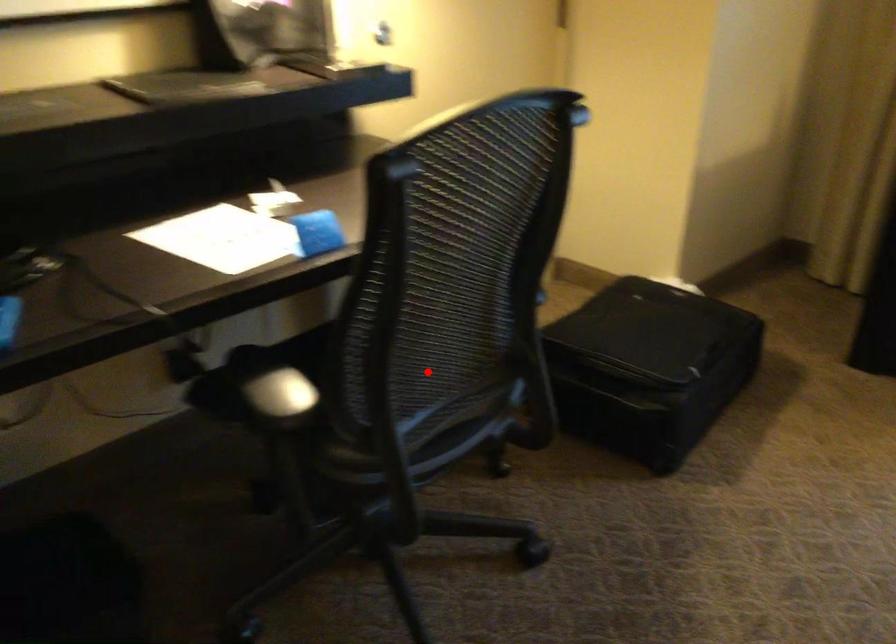
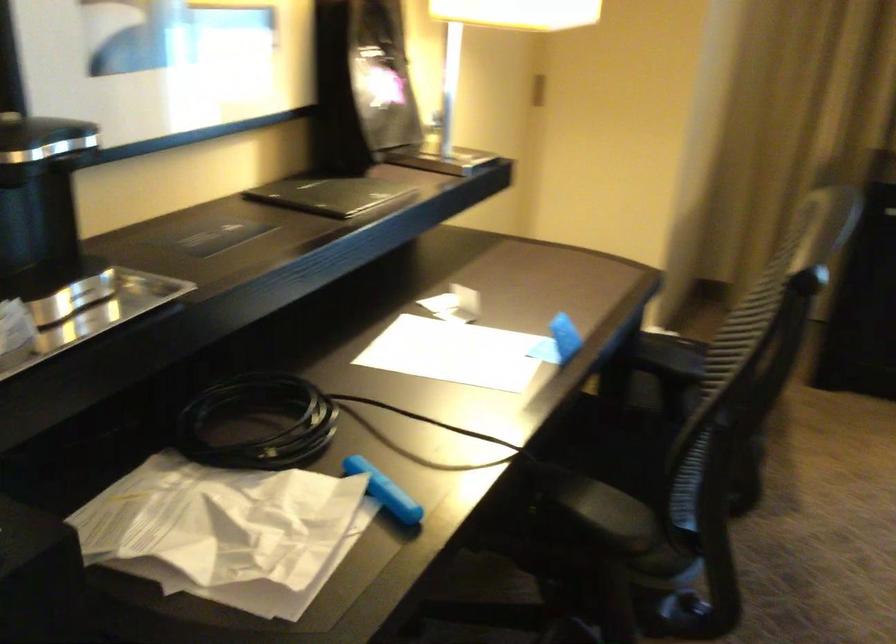
Question: I am providing you with two images of the same scene from different viewpoints. Image1 has a red point marked. In image2, the corresponding 3D location appears at what relative position? Reply with the corresponding letter.

Choices:
 (A) Closer
 (B) Farther

Answer: (B)